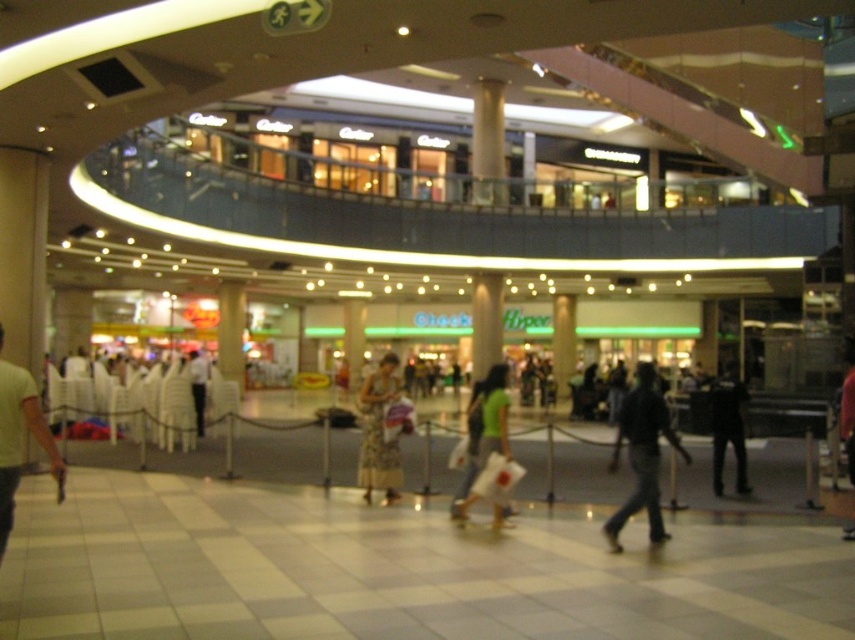
You are a store manager organizing a display in the mall. You have a green matte shirt at center and a floral dress at center. Which item should you place on the narrower hanger to ensure it fits properly?

The green matte shirt at center is thinner than the floral dress at center, so it should be placed on the narrower hanger to fit properly.

What are the coordinates of the green cotton shirt at center in the image?

Answer: The green cotton shirt at center is located at point coordinates (488, 417).

You are a store manager in the mall and need to place a new display stand between the green matte shirt at center and the black matte pants at lower right. Based on their positions, which object should the display stand be closer to?

The display stand should be closer to the green matte shirt at center because it is nearer to the viewer compared to the black matte pants at lower right, so positioning it near the shirt would make it more visible to shoppers passing by.